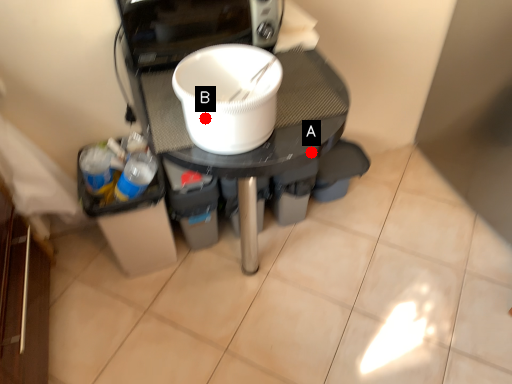
Question: Two points are circled on the image, labeled by A and B beside each circle. Which point is closer to the camera?

Choices:
 (A) A is closer
 (B) B is closer

Answer: (B)